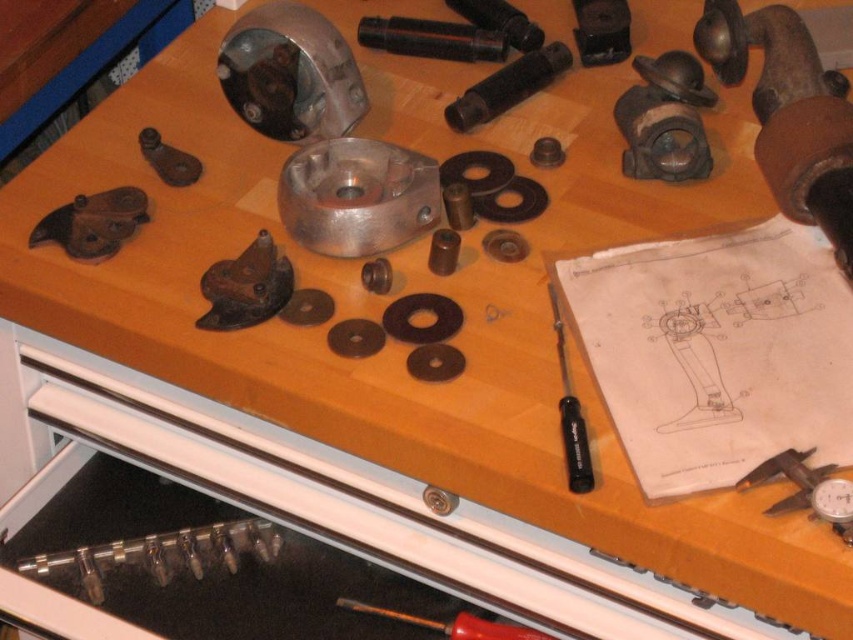
Question: Which is farther from the clear plastic tube at lower left?

Choices:
 (A) metallic gauge at lower right
 (B) red metallic screwdriver at center

Answer: (A)

Question: Can you confirm if metallic gauge at lower right is positioned to the left of metallic silver bolt at center?

Choices:
 (A) no
 (B) yes

Answer: (A)

Question: Is metallic gauge at lower right below black plastic screwdriver at center-right?

Choices:
 (A) yes
 (B) no

Answer: (A)

Question: Does metallic gauge at lower right come behind black plastic screwdriver at center-right?

Choices:
 (A) yes
 (B) no

Answer: (B)

Question: Among these points, which one is farthest from the camera?

Choices:
 (A) (238, 536)
 (B) (817, 474)
 (C) (451, 497)
 (D) (560, 356)

Answer: (A)

Question: Among these points, which one is nearest to the camera?

Choices:
 (A) (502, 627)
 (B) (819, 513)
 (C) (444, 497)

Answer: (B)